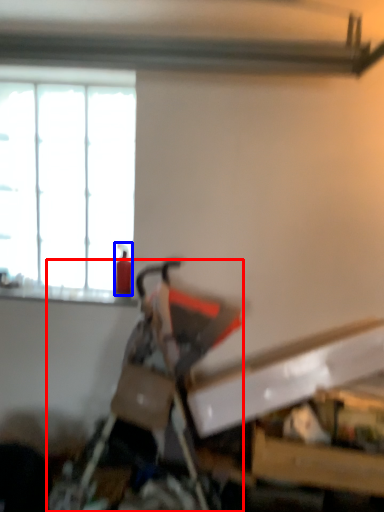
Question: Which object is further to the camera taking this photo, swivel chair (highlighted by a red box) or extinguisher (highlighted by a blue box)?

Choices:
 (A) swivel chair
 (B) extinguisher

Answer: (B)